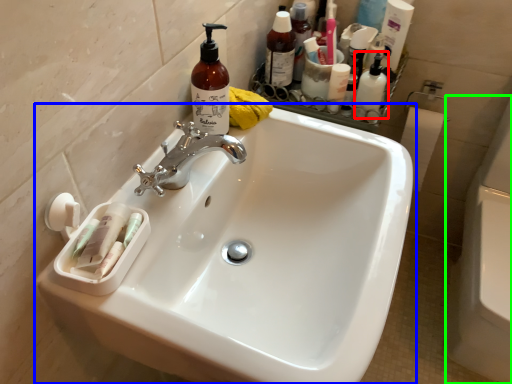
Question: Considering the real-world distances, which object is closest to toiletry (highlighted by a red box)? sink (highlighted by a blue box) or bath (highlighted by a green box).

Choices:
 (A) sink
 (B) bath

Answer: (A)